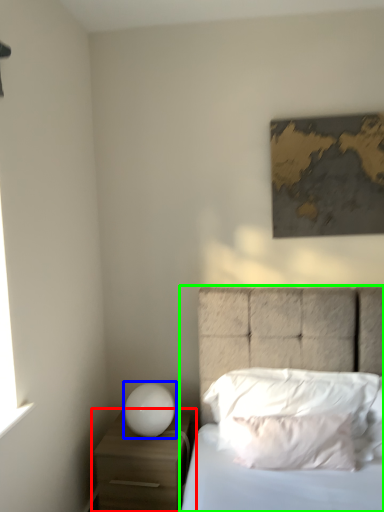
Question: Which object is positioned farthest from nightstand (highlighted by a red box)? Select from table lamp (highlighted by a blue box) and bed (highlighted by a green box).

Choices:
 (A) table lamp
 (B) bed

Answer: (B)